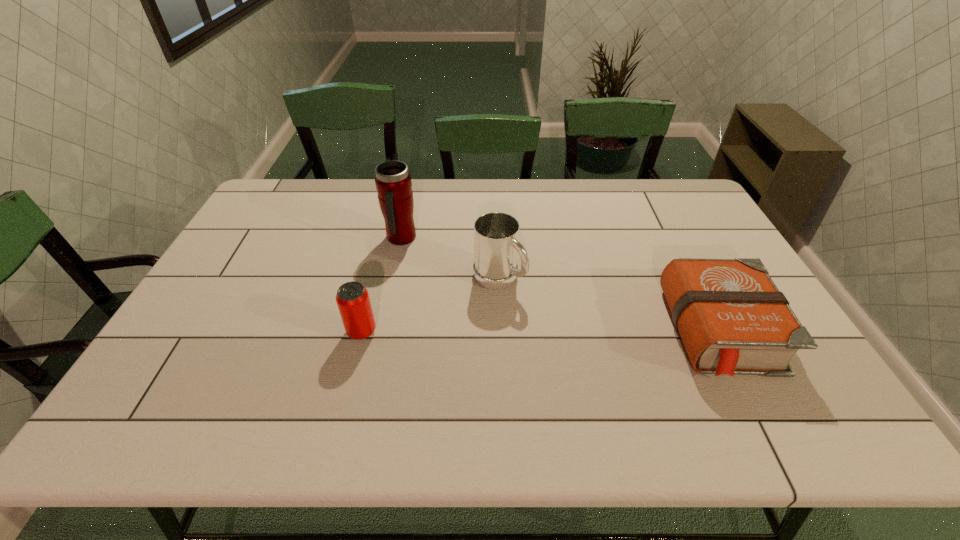
Find the location of a particular element. vacant space on the desktop that is between the can and the Bible and is positioned on the side with the handle of the tallest object is located at coordinates (494, 332).

This screenshot has width=960, height=540. In order to click on free space on the desktop that is between the can and the rightmost object and is positioned on the side of the mug with the handle in this screenshot , I will do `click(569, 332)`.